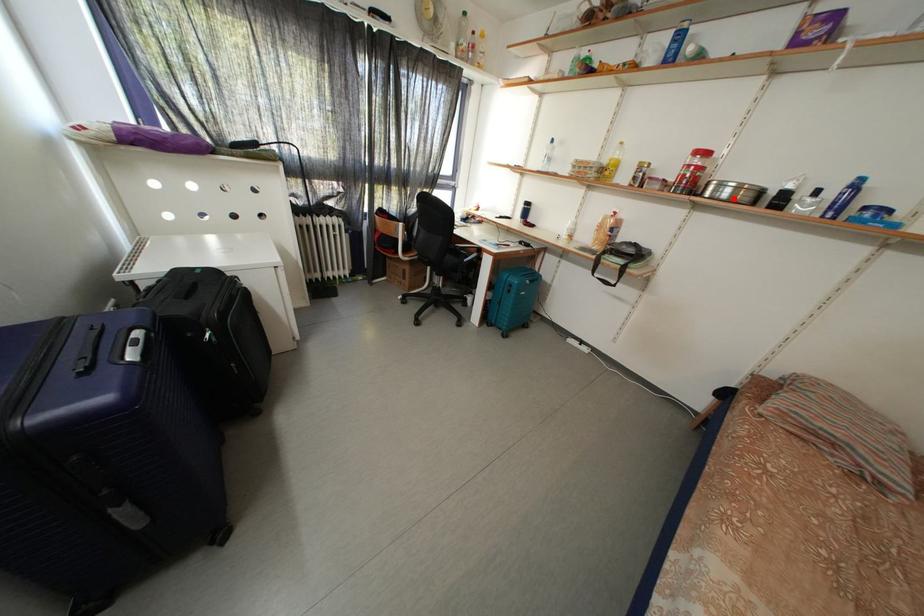
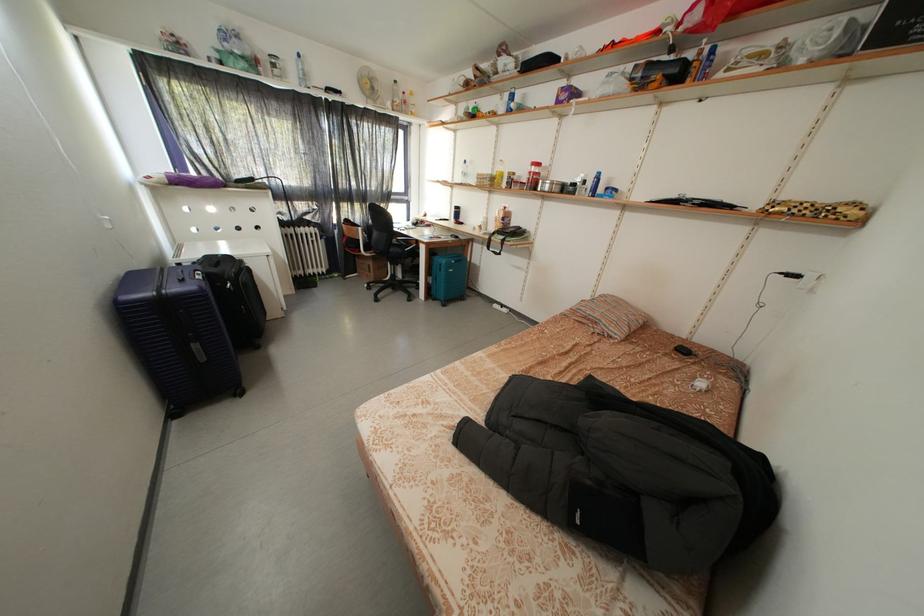
Find the pixel in the second image that matches the highlighted location in the first image.

(554, 193)